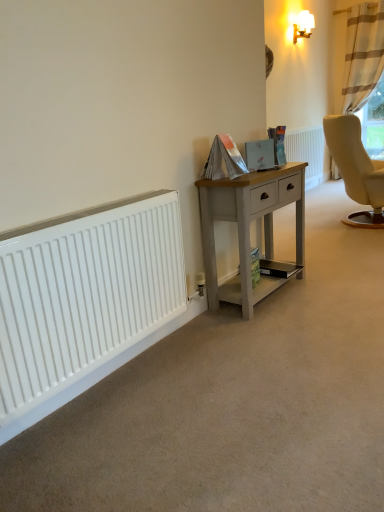
Question: From a real-world perspective, is beige striped curtain at upper right positioned above or below white textured radiator at center, the second radiator viewed from the left?

Choices:
 (A) below
 (B) above

Answer: (B)

Question: Considering the positions of point (350, 109) and point (309, 137), is point (350, 109) closer or farther from the camera than point (309, 137)?

Choices:
 (A) closer
 (B) farther

Answer: (A)

Question: Estimate the real-world distances between objects in this image. Which object is closer to the white smooth radiator at lower left, the first radiator in the left-to-right sequence?

Choices:
 (A) white glossy wall lamp at upper right
 (B) beige striped curtain at upper right
 (C) white textured radiator at center, the 1th radiator positioned from the right
 (D) light gray wood desk at center

Answer: (D)

Question: Which object is positioned closest to the light gray wood desk at center?

Choices:
 (A) white glossy wall lamp at upper right
 (B) white textured radiator at center, the 1th radiator positioned from the right
 (C) white smooth radiator at lower left, the first radiator in the left-to-right sequence
 (D) beige striped curtain at upper right

Answer: (C)